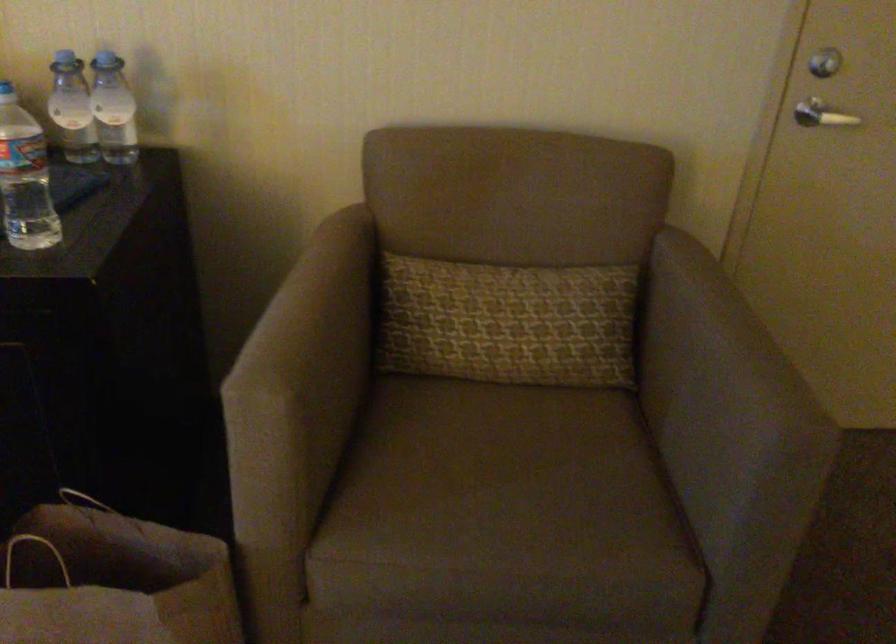
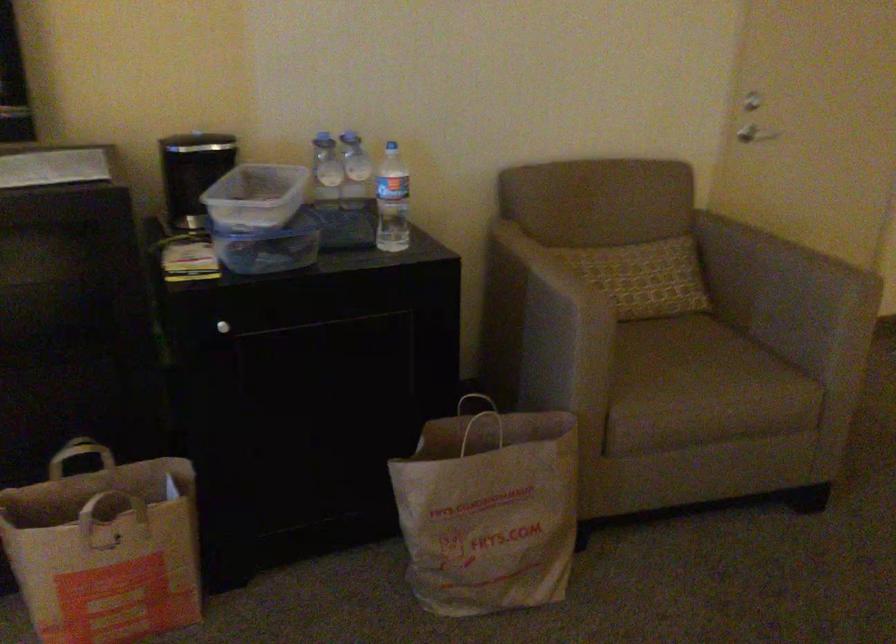
Locate, in the second image, the point that corresponds to point 536,498 in the first image.

(707, 366)